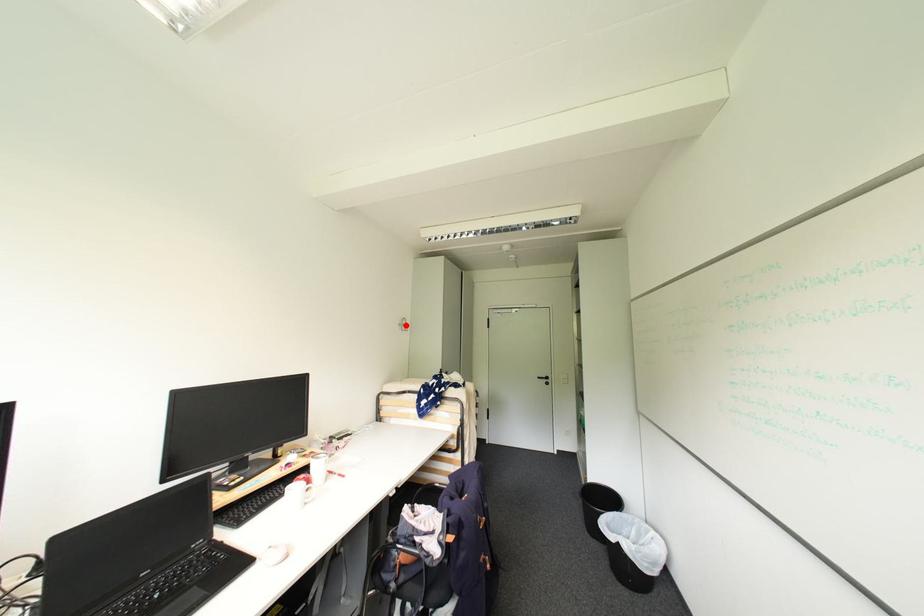
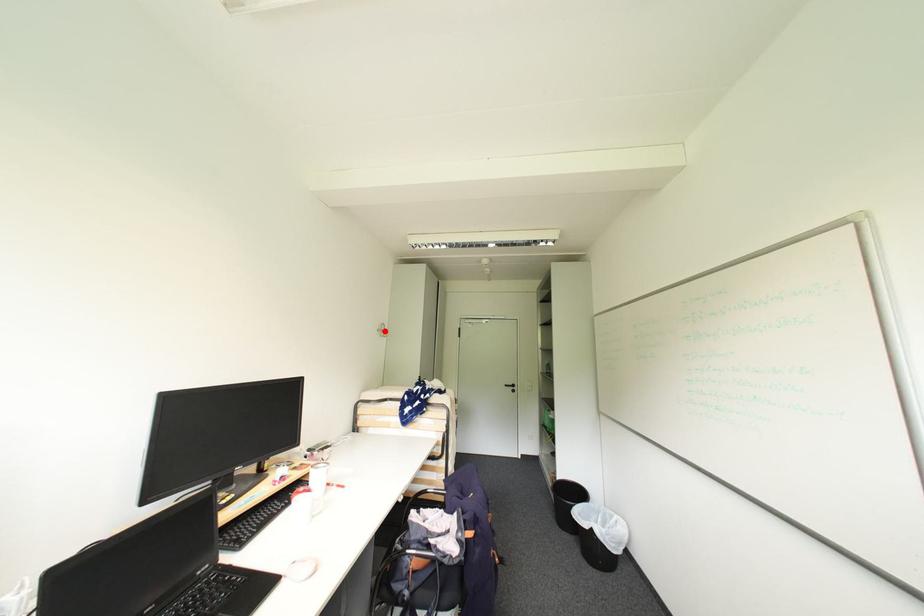
I am providing you with two images of the same scene from different viewpoints. A red point is marked on the first image and another point is marked on the second image. Is the red point in image1 aligned with the point shown in image2?

Yes